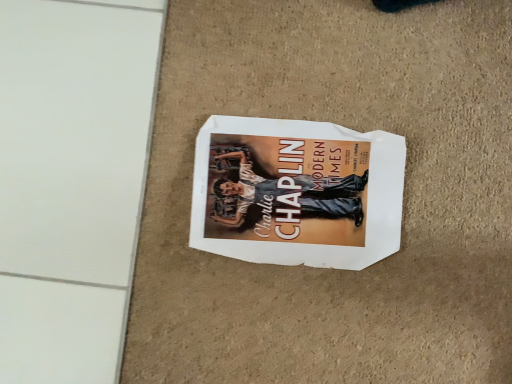
The image size is (512, 384). Describe the element at coordinates (297, 192) in the screenshot. I see `matte paper poster at center` at that location.

Where is `matte paper poster at center`? matte paper poster at center is located at coordinates (297, 192).

Identify the location of matte paper poster at center. (297, 192).